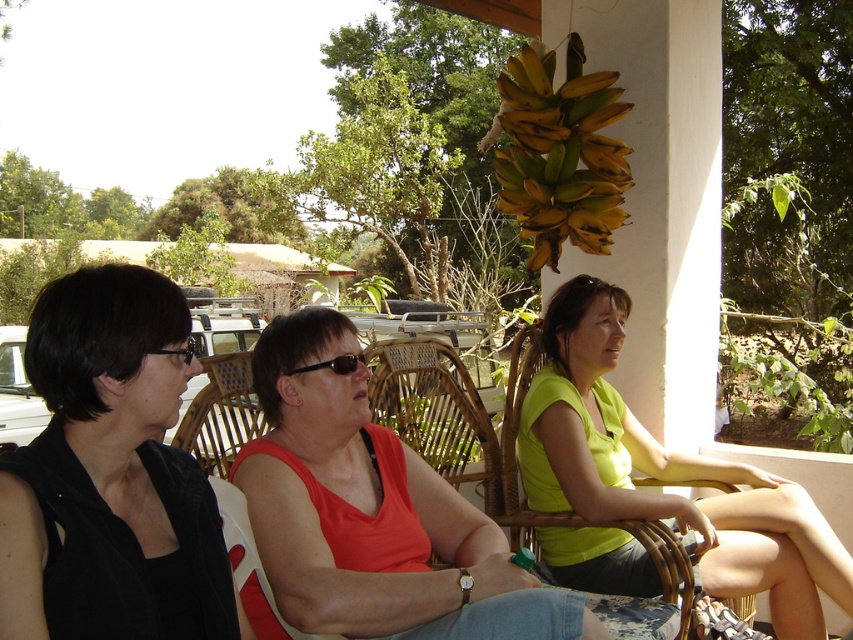
Who is shorter, matte green shirt at center or yellow-green matte bananas at upper center?

yellow-green matte bananas at upper center

Describe the element at coordinates (665, 472) in the screenshot. The height and width of the screenshot is (640, 853). I see `matte green shirt at center` at that location.

Who is more forward, (573, 465) or (556, 221)?

Point (573, 465)

At what (x,y) coordinates should I click in order to perform the action: click on matte green shirt at center. Please return your answer as a coordinate pair (x, y). Looking at the image, I should click on (665, 472).

Can you confirm if matte orange tank top at center is positioned below woven rattan chair at center?

Yes.

Who is lower down, matte orange tank top at center or woven rattan chair at center?

matte orange tank top at center

Between point (248, 483) and point (395, 346), which one is positioned in front?

Point (248, 483)

Locate an element on the screen. The width and height of the screenshot is (853, 640). matte orange tank top at center is located at coordinates (373, 513).

Is yellow-green matte bananas at upper center closer to camera compared to black plastic sunglasses at center?

No, it is behind black plastic sunglasses at center.

Does yellow-green matte bananas at upper center have a lesser width compared to black plastic sunglasses at center?

Incorrect, yellow-green matte bananas at upper center's width is not less than black plastic sunglasses at center's.

Between point (527, 204) and point (349, 358), which one is positioned in front?

Point (349, 358) is more forward.

Find the location of a particular element. Image resolution: width=853 pixels, height=640 pixels. yellow-green matte bananas at upper center is located at coordinates (560, 154).